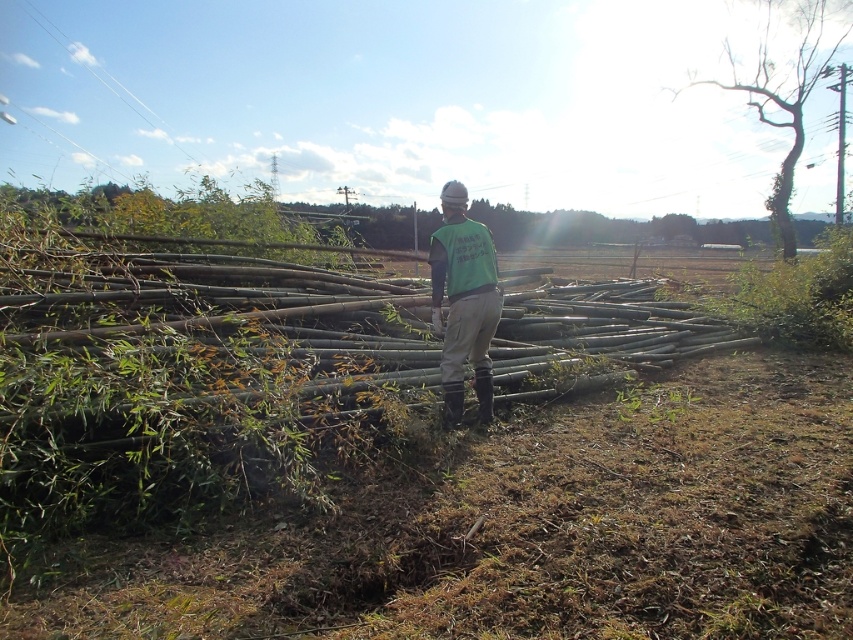
Question: Can you confirm if bare wood tree at upper right is thinner than green fabric vest at center?

Choices:
 (A) yes
 (B) no

Answer: (B)

Question: Which of the following is the closest to the observer?

Choices:
 (A) bare wood tree at upper right
 (B) green fabric vest at center

Answer: (B)

Question: In this image, where is bare wood tree at upper right located relative to green fabric vest at center?

Choices:
 (A) above
 (B) below

Answer: (A)

Question: Can you confirm if bare wood tree at upper right is bigger than green fabric vest at center?

Choices:
 (A) yes
 (B) no

Answer: (A)